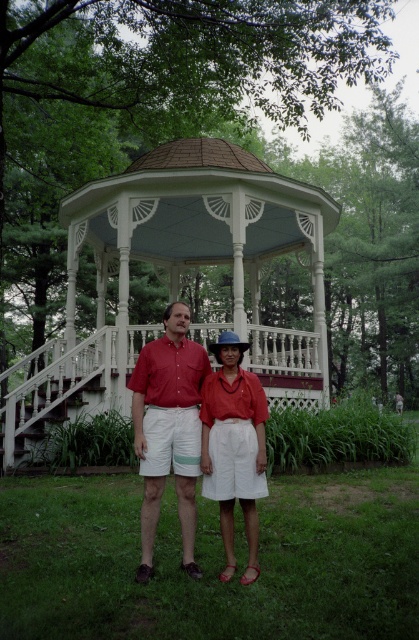
Question: Estimate the real-world distances between objects in this image. Which object is closer to the matte red blouse at center?

Choices:
 (A) matte red shirt at center
 (B) white painted wood porch at center

Answer: (A)

Question: Is white painted wood porch at center smaller than matte red blouse at center?

Choices:
 (A) no
 (B) yes

Answer: (B)

Question: Which point is farther from the camera taking this photo?

Choices:
 (A) (183, 541)
 (B) (253, 529)

Answer: (A)

Question: Does matte red shirt at center appear on the left side of matte red blouse at center?

Choices:
 (A) no
 (B) yes

Answer: (B)

Question: Does white painted wood porch at center lie behind matte red blouse at center?

Choices:
 (A) no
 (B) yes

Answer: (B)

Question: Considering the real-world distances, which object is farthest from the matte red shirt at center?

Choices:
 (A) matte red blouse at center
 (B) white painted wood porch at center

Answer: (B)